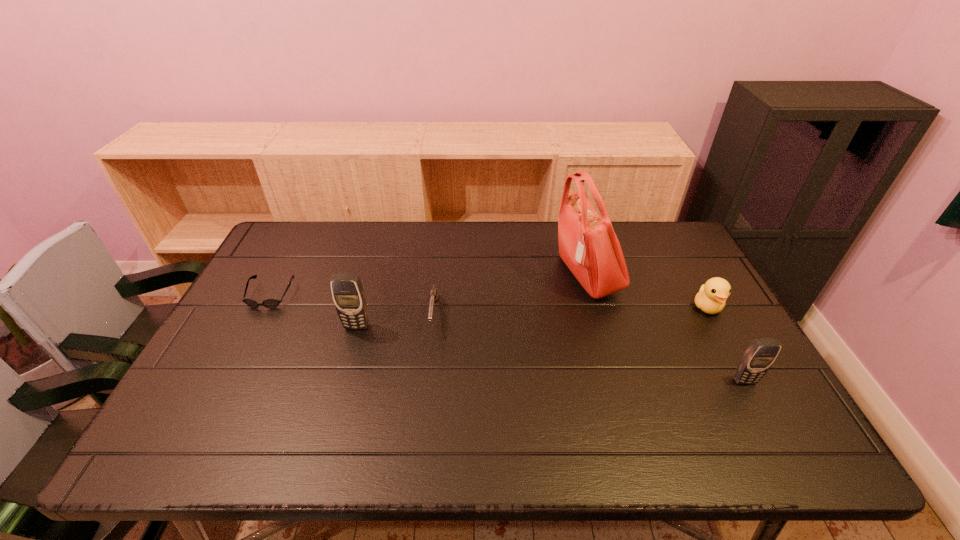
What are the coordinates of `object that is the fourth closest to the third object from left to right` in the screenshot? It's located at (712, 295).

Locate which object is the fourth closest to the farther cellular telephone. Please provide its 2D coordinates. Your answer should be formatted as a tuple, i.e. [(x, y)], where the tuple contains the x and y coordinates of a point satisfying the conditions above.

[(712, 295)]

Locate an element on the screen. This screenshot has width=960, height=540. vacant point that satisfies the following two spatial constraints: 1. on the front-facing side of the third object from right to left; 2. on the front face of the taller cellular telephone is located at coordinates (601, 326).